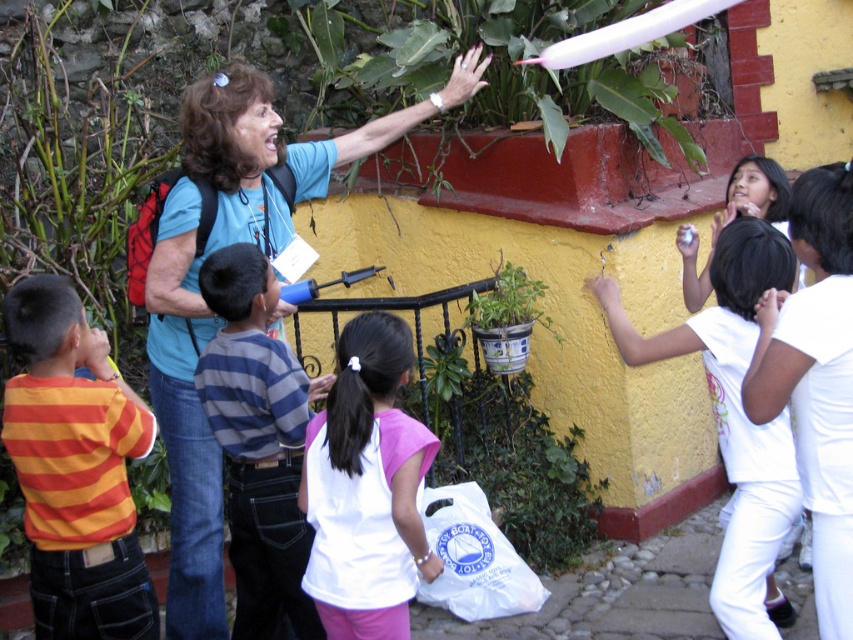
Question: Does orange striped shirt at left have a greater width compared to white cotton shirt at right?

Choices:
 (A) no
 (B) yes

Answer: (A)

Question: Based on their relative distances, which object is nearer to the green leafy plant at upper center?

Choices:
 (A) orange striped shirt at left
 (B) matte blue shirt at center

Answer: (B)

Question: Does green leafy plant at upper center have a greater width compared to green glazed pot at center?

Choices:
 (A) yes
 (B) no

Answer: (A)

Question: Can you confirm if matte blue shirt at center is positioned below white matte shirt at center?

Choices:
 (A) yes
 (B) no

Answer: (B)

Question: Which point is farther from the camera taking this photo?

Choices:
 (A) (216, 593)
 (B) (351, 577)
 (C) (401, 88)

Answer: (C)

Question: Which object appears closest to the camera in this image?

Choices:
 (A) striped fabric shirt at center
 (B) white cotton shirt at right

Answer: (B)